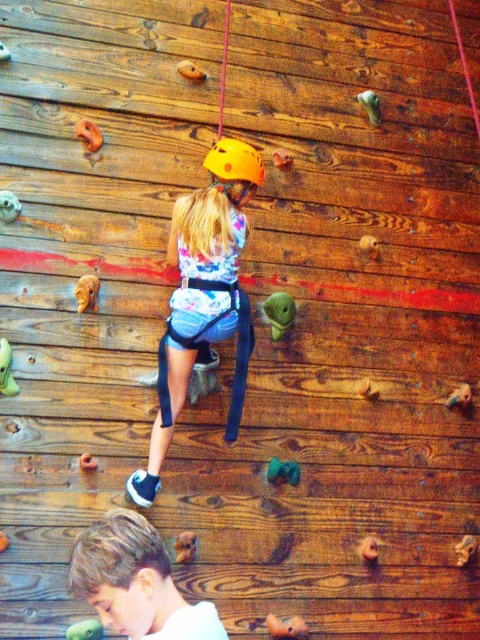
Is blonde hair boy at lower left thinner than yellow matte helmet at center?

No.

Locate an element on the screen. The width and height of the screenshot is (480, 640). blonde hair boy at lower left is located at coordinates (135, 580).

Is point (146, 552) in front of point (204, 168)?

That is True.

Where is `blonde hair boy at lower left`? This screenshot has height=640, width=480. blonde hair boy at lower left is located at coordinates (135, 580).

Between matte yellow helmet at center and yellow matte helmet at center, which one is positioned higher?

yellow matte helmet at center is higher up.

Is point (167, 356) less distant than point (254, 148)?

Yes.

Locate an element on the screen. The height and width of the screenshot is (640, 480). matte yellow helmet at center is located at coordinates (204, 296).

Between matte yellow helmet at center and blonde hair boy at lower left, which one appears on the right side from the viewer's perspective?

Positioned to the right is matte yellow helmet at center.

Does point (237, 404) come closer to viewer compared to point (172, 612)?

No, it is not.

Who is more forward, (178, 348) or (87, 595)?

Point (87, 595)

The width and height of the screenshot is (480, 640). I want to click on matte yellow helmet at center, so 204,296.